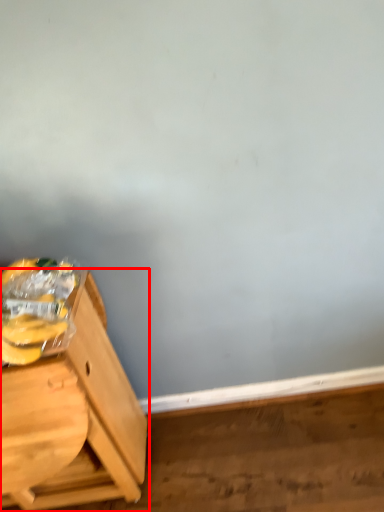
Question: From the image's perspective, where is furniture (annotated by the red box) located in relation to banana in the image?

Choices:
 (A) above
 (B) below

Answer: (B)